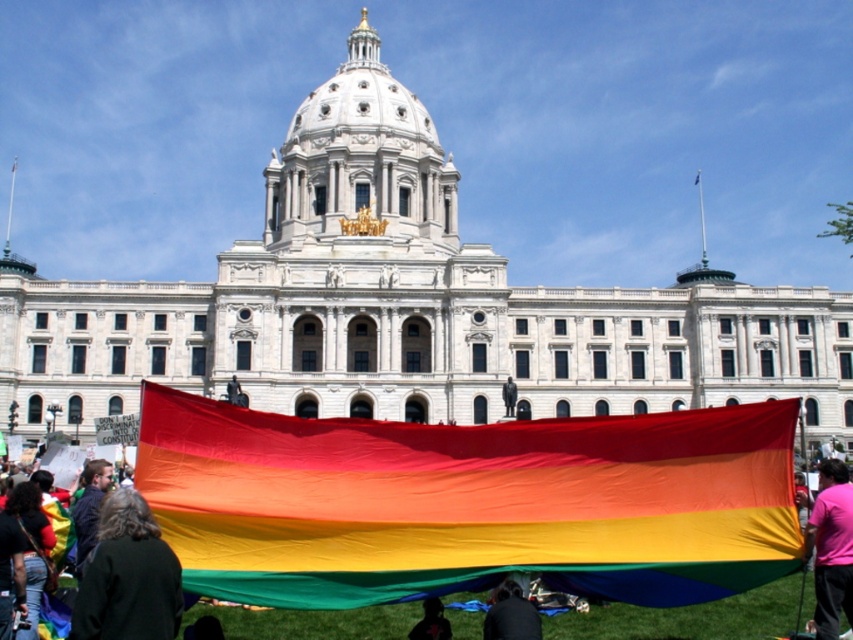
Who is positioned more to the left, rainbow fabric flag at center or dark brown leather jacket at lower left?

dark brown leather jacket at lower left is more to the left.

Does rainbow fabric flag at center come in front of dark brown leather jacket at lower left?

No, rainbow fabric flag at center is behind dark brown leather jacket at lower left.

What are the coordinates of `rainbow fabric flag at center` in the screenshot? It's located at (469, 502).

Is rainbow fabric at lower left shorter than silhouette fabric at lower center?

Incorrect, rainbow fabric at lower left's height does not fall short of silhouette fabric at lower center's.

Describe the element at coordinates (122, 564) in the screenshot. I see `rainbow fabric at lower left` at that location.

You are a GUI agent. You are given a task and a screenshot of the screen. Output one action in this format:
    pyautogui.click(x=<x>, y=<y>)
    Task: Click on the rainbow fabric at lower left
    
    Given the screenshot: What is the action you would take?
    pyautogui.click(x=122, y=564)

Can you confirm if rainbow fabric at lower left is positioned below pink fabric at lower right?

No, rainbow fabric at lower left is not below pink fabric at lower right.

Which is in front, point (115, 602) or point (845, 472)?

Point (115, 602) is in front.

Is point (158, 540) less distant than point (816, 596)?

That is True.

This screenshot has width=853, height=640. I want to click on rainbow fabric at lower left, so click(x=122, y=564).